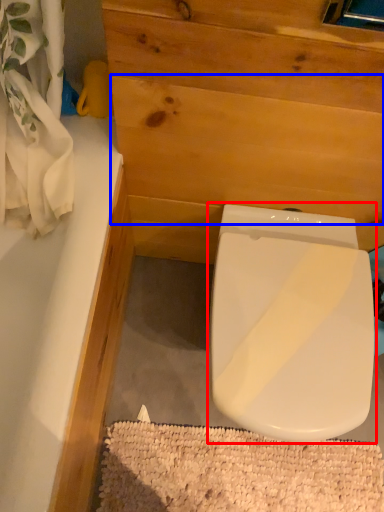
Question: Which object is closer to the camera taking this photo, toilet (highlighted by a red box) or plywood (highlighted by a blue box)?

Choices:
 (A) toilet
 (B) plywood

Answer: (B)